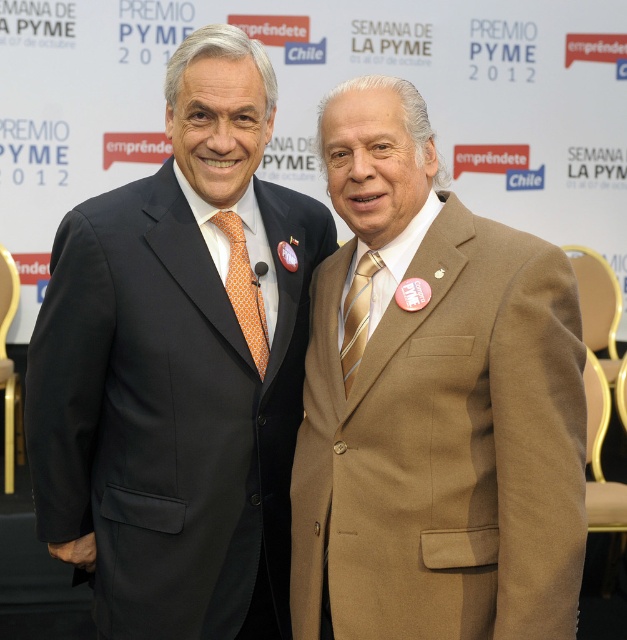
You are attending the PREMIO PYME 2012 event and notice two men standing against the backdrop. One is wearing a dark navy blue suit, and the other has a point marked at coordinates (179, 365). What color is the suit of the man at that specific coordinate?

The point at coordinates (179, 365) indicates the location of the matte black suit at center, so the man at that coordinate is wearing a matte black suit.